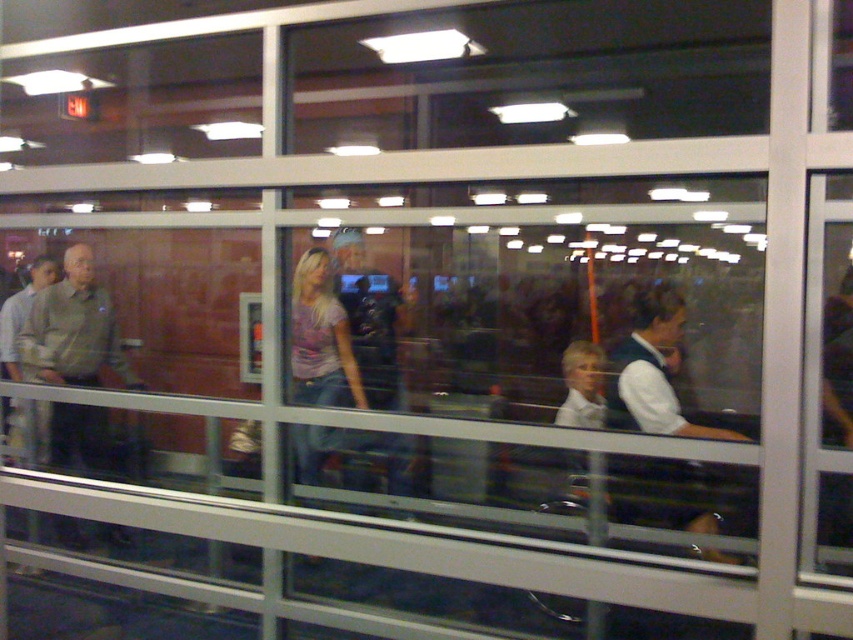
Question: Does white shirt at center have a smaller size compared to matte purple shirt at center?

Choices:
 (A) yes
 (B) no

Answer: (B)

Question: Does matte gray shirt at left appear over white shirt at center?

Choices:
 (A) no
 (B) yes

Answer: (B)

Question: Among these points, which one is nearest to the camera?

Choices:
 (A) (650, 429)
 (B) (131, 372)
 (C) (328, 304)

Answer: (A)

Question: Considering the relative positions of white shirt at center and matte purple shirt at center in the image provided, where is white shirt at center located with respect to matte purple shirt at center?

Choices:
 (A) below
 (B) above

Answer: (A)

Question: Based on their relative distances, which object is farther from the matte purple shirt at center?

Choices:
 (A) white shirt at center
 (B) matte gray shirt at left

Answer: (A)

Question: Which of the following is the farthest from the observer?

Choices:
 (A) white shirt at center
 (B) matte purple shirt at center
 (C) matte gray shirt at left

Answer: (C)